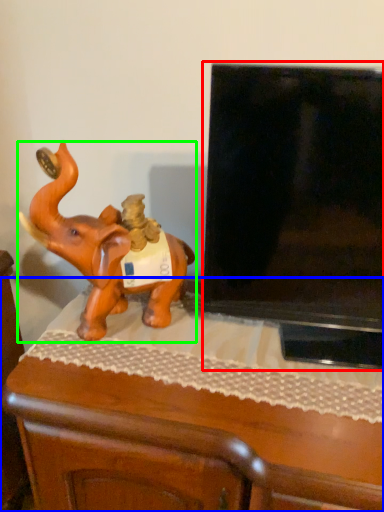
Question: Which object is positioned farthest from television (highlighted by a red box)? Select from furniture (highlighted by a blue box) and elephant (highlighted by a green box).

Choices:
 (A) furniture
 (B) elephant

Answer: (B)